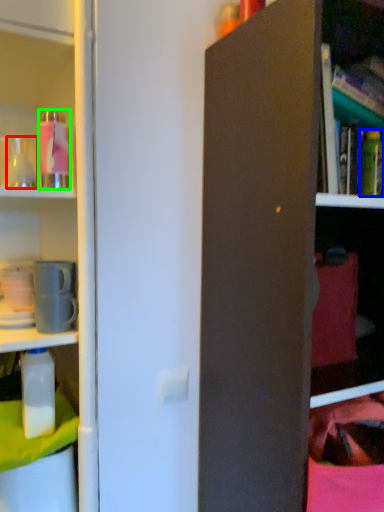
Question: Considering the real-world distances, which object is farthest from bottle (highlighted by a red box)? bottle (highlighted by a blue box) or bottle (highlighted by a green box)?

Choices:
 (A) bottle
 (B) bottle

Answer: (A)